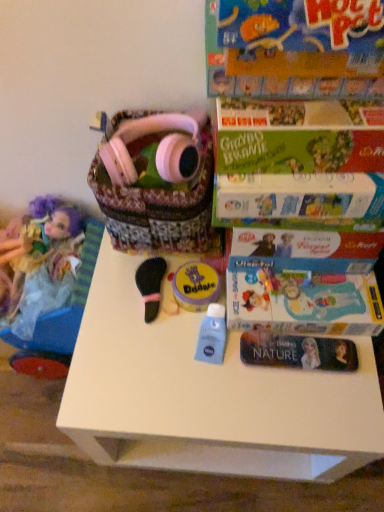
Where is `free space to the back side of black felt brush at center, which is the 1th toy in left-to-right order`? The image size is (384, 512). free space to the back side of black felt brush at center, which is the 1th toy in left-to-right order is located at coordinates (143, 258).